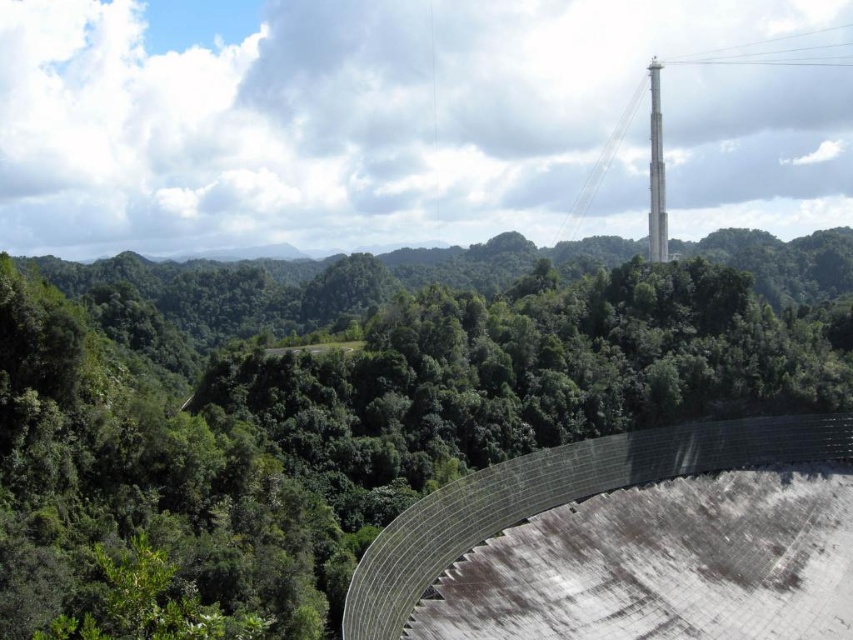
Question: Is green leafy forest at center further to the viewer compared to metallic gray dam at center?

Choices:
 (A) no
 (B) yes

Answer: (A)

Question: Is green leafy forest at center to the left of metallic gray dam at center from the viewer's perspective?

Choices:
 (A) yes
 (B) no

Answer: (A)

Question: Can you confirm if green leafy forest at center is positioned to the left of metallic gray dam at center?

Choices:
 (A) no
 (B) yes

Answer: (B)

Question: Which object appears closest to the camera in this image?

Choices:
 (A) metallic gray dam at center
 (B) green leafy forest at center

Answer: (B)